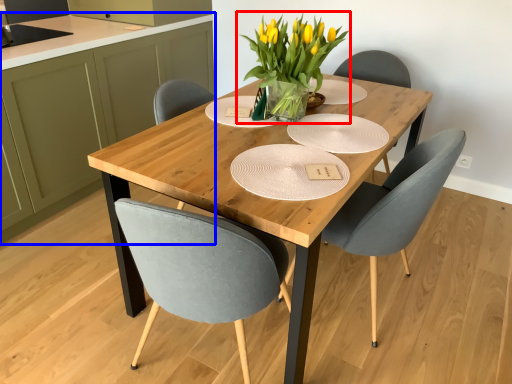
Question: Among these objects, which one is nearest to the camera, houseplant (highlighted by a red box) or cabinetry (highlighted by a blue box)?

Choices:
 (A) houseplant
 (B) cabinetry

Answer: (A)